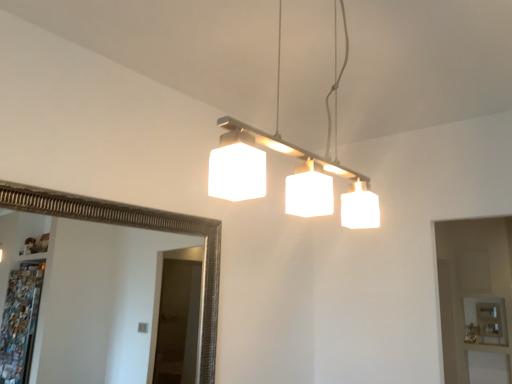
Image resolution: width=512 pixels, height=384 pixels. What do you see at coordinates (287, 177) in the screenshot? I see `white frosted glass light fixture at upper center` at bounding box center [287, 177].

Where is `white frosted glass light fixture at upper center`? The image size is (512, 384). white frosted glass light fixture at upper center is located at coordinates (287, 177).

Identify the location of white frosted glass light fixture at upper center. Image resolution: width=512 pixels, height=384 pixels. (287, 177).